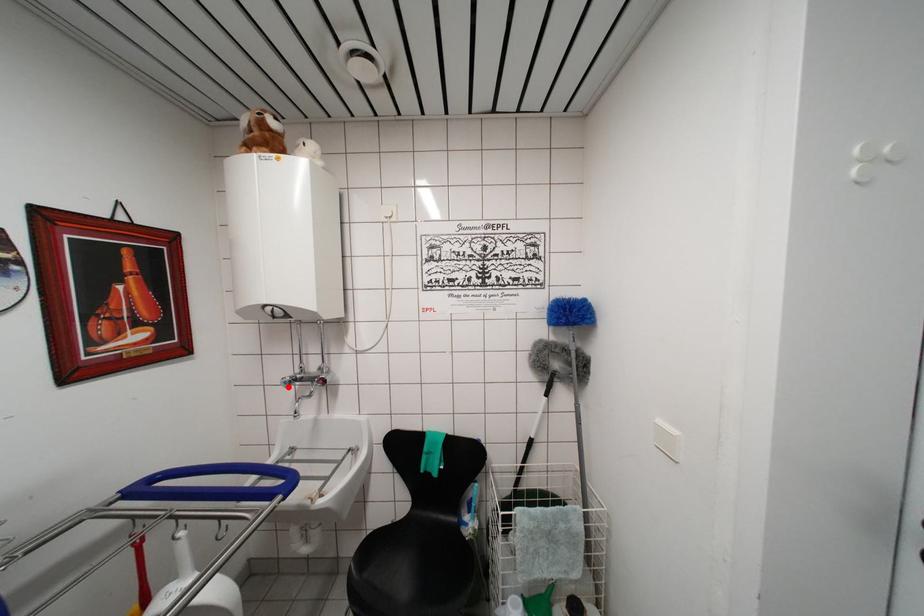
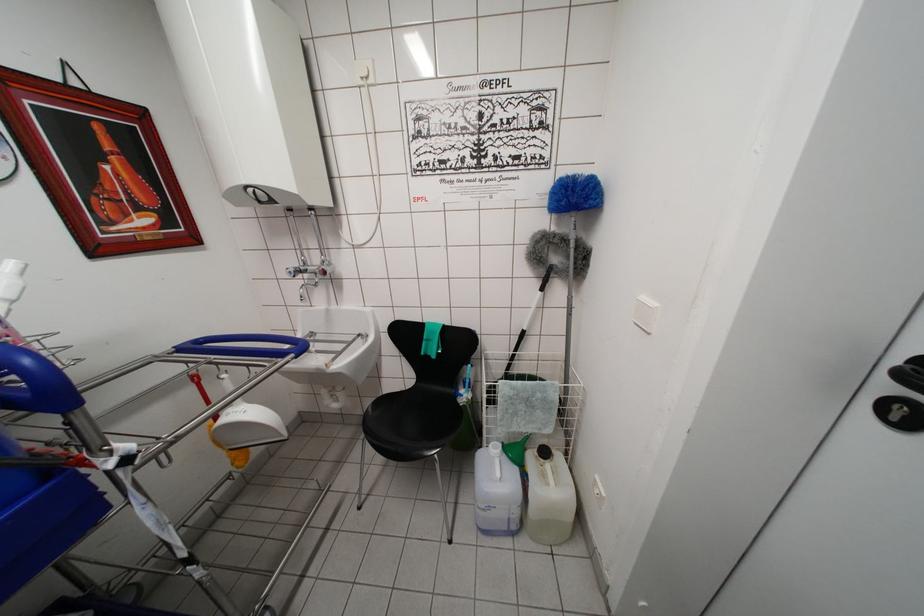
In the second image, find the point that corresponds to the highlighted location in the first image.

(293, 277)